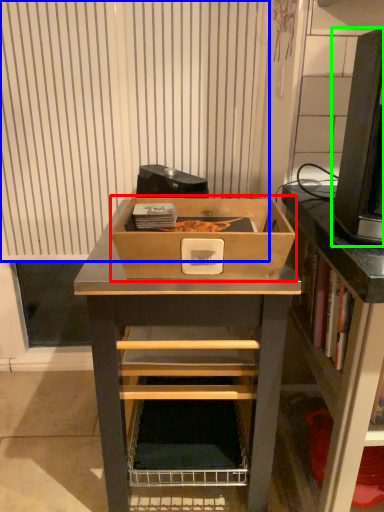
Question: Considering the real-world distances, which object is closest to box (highlighted by a red box)? curtain (highlighted by a blue box) or desktop computer (highlighted by a green box).

Choices:
 (A) curtain
 (B) desktop computer

Answer: (B)